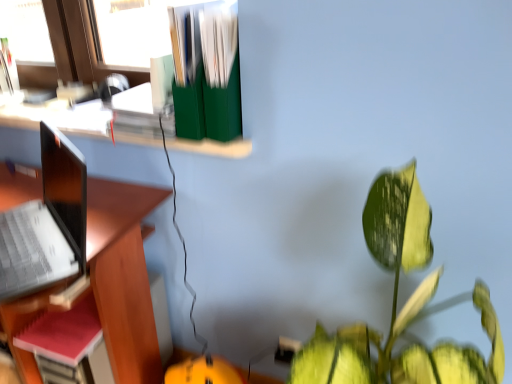
Question: Is green matte file folders at upper center to the right of green matte file organizer at upper center from the viewer's perspective?

Choices:
 (A) no
 (B) yes

Answer: (B)

Question: Is green matte file folders at upper center closer to camera compared to green matte file organizer at upper center?

Choices:
 (A) no
 (B) yes

Answer: (B)

Question: Considering the relative sizes of green matte file folders at upper center and green matte file organizer at upper center in the image provided, is green matte file folders at upper center taller than green matte file organizer at upper center?

Choices:
 (A) yes
 (B) no

Answer: (A)

Question: Considering the relative positions of green matte file folders at upper center and green matte file organizer at upper center in the image provided, is green matte file folders at upper center behind green matte file organizer at upper center?

Choices:
 (A) no
 (B) yes

Answer: (A)

Question: Does green matte file folders at upper center have a smaller size compared to green matte file organizer at upper center?

Choices:
 (A) no
 (B) yes

Answer: (B)

Question: In the image, is red matte notebook at left positioned in front of or behind green glossy leafy plant at lower right?

Choices:
 (A) front
 (B) behind

Answer: (B)

Question: In terms of height, does red matte notebook at left look taller or shorter compared to green glossy leafy plant at lower right?

Choices:
 (A) short
 (B) tall

Answer: (A)

Question: From a real-world perspective, relative to green glossy leafy plant at lower right, is red matte notebook at left vertically above or below?

Choices:
 (A) above
 (B) below

Answer: (B)

Question: Would you say red matte notebook at left is to the left or to the right of green glossy leafy plant at lower right in the picture?

Choices:
 (A) right
 (B) left

Answer: (B)

Question: Would you say red matte notebook at left is to the left or to the right of wooden desk at left in the picture?

Choices:
 (A) left
 (B) right

Answer: (B)

Question: Does point (x=56, y=354) appear closer or farther from the camera than point (x=147, y=367)?

Choices:
 (A) closer
 (B) farther

Answer: (A)

Question: Relative to wooden desk at left, is red matte notebook at left in front or behind?

Choices:
 (A) front
 (B) behind

Answer: (B)

Question: In terms of width, does red matte notebook at left look wider or thinner when compared to wooden desk at left?

Choices:
 (A) wide
 (B) thin

Answer: (B)

Question: Is point (76, 342) closer or farther from the camera than point (233, 127)?

Choices:
 (A) farther
 (B) closer

Answer: (A)

Question: Considering the positions of red matte notebook at left and green matte file folders at upper center in the image, is red matte notebook at left wider or thinner than green matte file folders at upper center?

Choices:
 (A) wide
 (B) thin

Answer: (B)